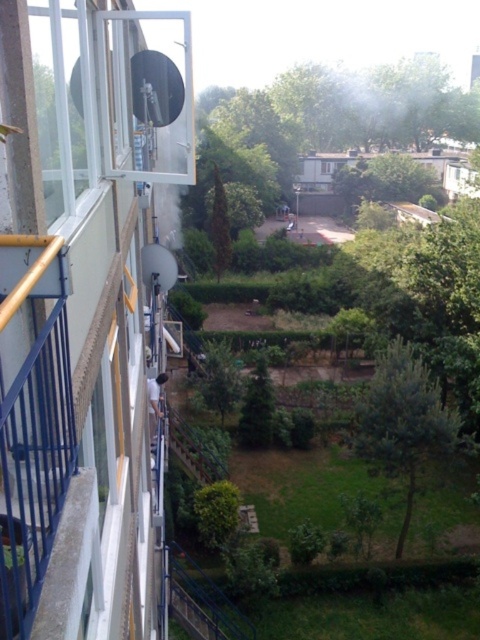
Question: Can you confirm if green leafy tree at center is smaller than green matte tree at center?

Choices:
 (A) no
 (B) yes

Answer: (B)

Question: Which point is farther to the camera?

Choices:
 (A) green leafy tree at lower right
 (B) green leafy tree at center
 (C) green matte tree at center

Answer: (C)

Question: Which point is closer to the camera?

Choices:
 (A) green leafy tree at center
 (B) green leafy tree at lower right
 (C) green matte tree at center

Answer: (A)

Question: Does green leafy tree at lower right have a greater width compared to green leafy tree at center?

Choices:
 (A) yes
 (B) no

Answer: (B)

Question: Which object is the closest to the green leafy tree at lower right?

Choices:
 (A) green leafy tree at center
 (B) green matte tree at center

Answer: (A)

Question: Considering the relative positions of green leafy tree at lower right and green matte tree at center in the image provided, where is green leafy tree at lower right located with respect to green matte tree at center?

Choices:
 (A) above
 (B) below

Answer: (A)